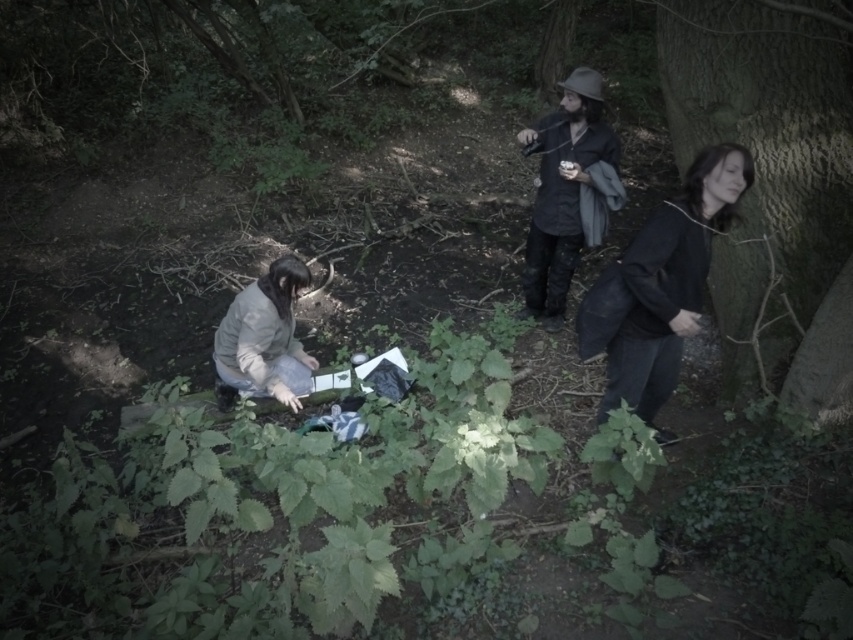
Is smooth bark tree at right positioned behind light gray fabric at lower left?

No.

Is smooth bark tree at right thinner than light gray fabric at lower left?

Incorrect, smooth bark tree at right's width is not less than light gray fabric at lower left's.

I want to click on smooth bark tree at right, so 773,182.

The height and width of the screenshot is (640, 853). What do you see at coordinates (660, 285) in the screenshot?
I see `dark gray fabric jacket at right` at bounding box center [660, 285].

Locate an element on the screen. This screenshot has width=853, height=640. dark gray fabric jacket at right is located at coordinates (660, 285).

Where is `dark gray fabric jacket at right`? The width and height of the screenshot is (853, 640). dark gray fabric jacket at right is located at coordinates (660, 285).

Can you confirm if smooth bark tree at right is thinner than dark gray fabric jacket at right?

No.

Which is below, smooth bark tree at right or dark gray fabric jacket at right?

dark gray fabric jacket at right is lower down.

You are a GUI agent. You are given a task and a screenshot of the screen. Output one action in this format:
    pyautogui.click(x=<x>, y=<y>)
    Task: Click on the smooth bark tree at right
    
    Given the screenshot: What is the action you would take?
    pyautogui.click(x=773, y=182)